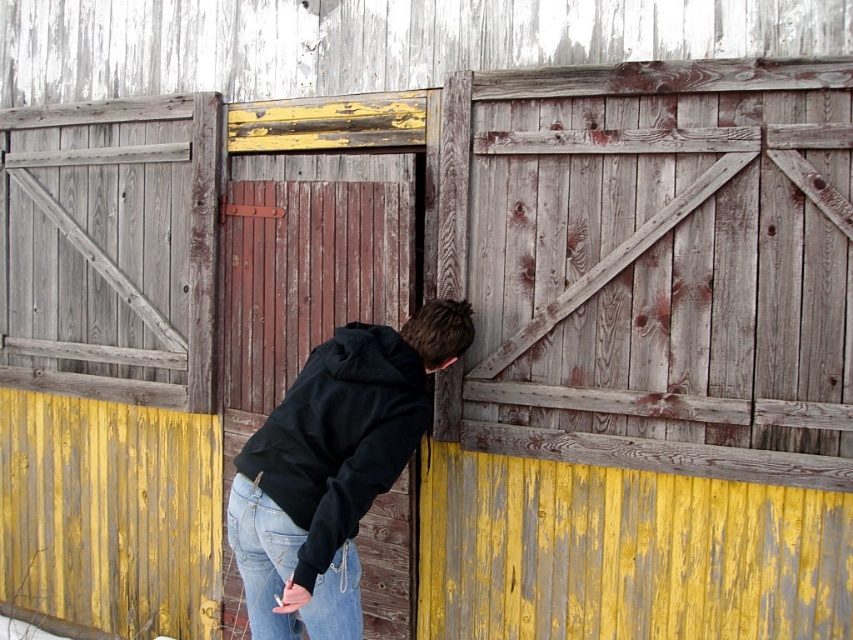
Question: Which of the following is the closest to the observer?

Choices:
 (A) jeans at lower center
 (B) black fleece sweatshirt at center

Answer: (B)

Question: Among these points, which one is farthest from the camera?

Choices:
 (A) (403, 387)
 (B) (706, 257)
 (C) (310, 589)

Answer: (B)

Question: Does weathered wood door at center have a greater width compared to jeans at lower center?

Choices:
 (A) no
 (B) yes

Answer: (B)

Question: Which object appears farthest from the camera in this image?

Choices:
 (A) black fleece sweatshirt at center
 (B) weathered wood door at center

Answer: (B)

Question: Is weathered wood door at center wider than black fleece sweatshirt at center?

Choices:
 (A) yes
 (B) no

Answer: (A)

Question: Observing the image, what is the correct spatial positioning of weathered wood door at center in reference to jeans at lower center?

Choices:
 (A) left
 (B) right

Answer: (B)